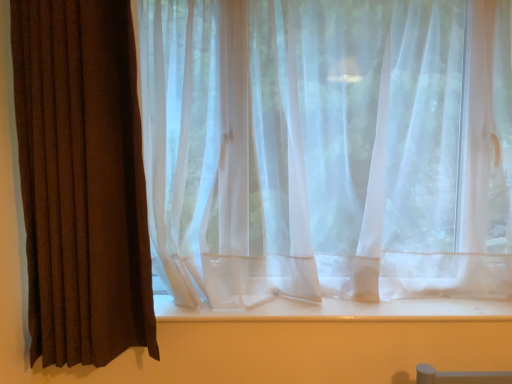
Question: Can you confirm if white smooth window sill at center is smaller than brown textured curtain at left, placed as the 2th curtain when sorted from right to left?

Choices:
 (A) no
 (B) yes

Answer: (B)

Question: Does white smooth window sill at center have a lesser height compared to brown textured curtain at left, placed as the 2th curtain when sorted from right to left?

Choices:
 (A) yes
 (B) no

Answer: (A)

Question: Is white smooth window sill at center looking in the opposite direction of brown textured curtain at left, placed as the 2th curtain when sorted from right to left?

Choices:
 (A) no
 (B) yes

Answer: (A)

Question: From a real-world perspective, does white smooth window sill at center stand above brown textured curtain at left, placed as the 2th curtain when sorted from right to left?

Choices:
 (A) no
 (B) yes

Answer: (A)

Question: Does white smooth window sill at center come behind brown textured curtain at left, placed as the 2th curtain when sorted from right to left?

Choices:
 (A) no
 (B) yes

Answer: (B)

Question: Is white smooth window sill at center directly adjacent to brown textured curtain at left, positioned as the 1th curtain in left-to-right order?

Choices:
 (A) yes
 (B) no

Answer: (B)

Question: From a real-world perspective, is translucent white curtain at center, positioned as the 1th curtain in right-to-left order, on top of white smooth window sill at center?

Choices:
 (A) no
 (B) yes

Answer: (B)

Question: Can we say translucent white curtain at center, positioned as the 1th curtain in right-to-left order, lies outside white smooth window sill at center?

Choices:
 (A) no
 (B) yes

Answer: (B)

Question: Is translucent white curtain at center, which is the second curtain from left to right, shorter than white smooth window sill at center?

Choices:
 (A) yes
 (B) no

Answer: (B)

Question: From the image's perspective, is translucent white curtain at center, which is the second curtain from left to right, on white smooth window sill at center?

Choices:
 (A) yes
 (B) no

Answer: (A)

Question: Is translucent white curtain at center, positioned as the 1th curtain in right-to-left order, at the left side of white smooth window sill at center?

Choices:
 (A) yes
 (B) no

Answer: (B)

Question: Is translucent white curtain at center, positioned as the 1th curtain in right-to-left order, positioned in front of white smooth window sill at center?

Choices:
 (A) yes
 (B) no

Answer: (A)

Question: Considering the relative positions of brown textured curtain at left, positioned as the 1th curtain in left-to-right order, and translucent white curtain at center, which is the second curtain from left to right, in the image provided, is brown textured curtain at left, positioned as the 1th curtain in left-to-right order, to the right of translucent white curtain at center, which is the second curtain from left to right, from the viewer's perspective?

Choices:
 (A) yes
 (B) no

Answer: (B)